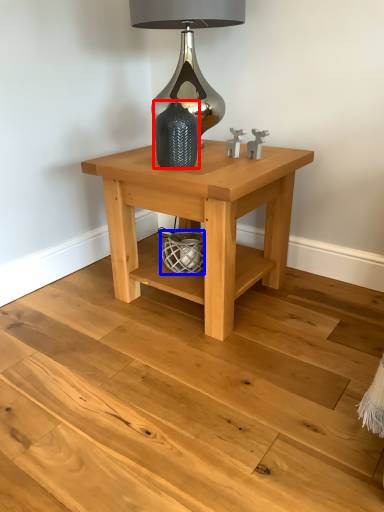
Question: Which object appears closest to the camera in this image, vase (highlighted by a red box) or basket (highlighted by a blue box)?

Choices:
 (A) vase
 (B) basket

Answer: (A)